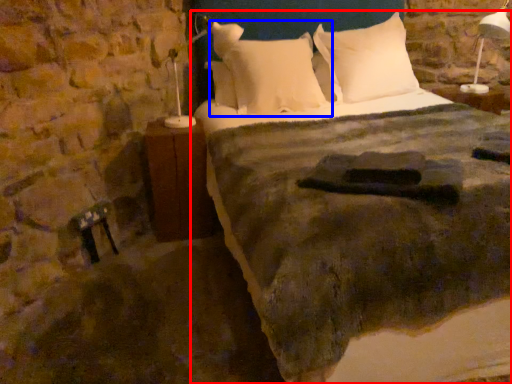
Question: Which object is closer to the camera taking this photo, bed (highlighted by a red box) or pillow (highlighted by a blue box)?

Choices:
 (A) bed
 (B) pillow

Answer: (A)